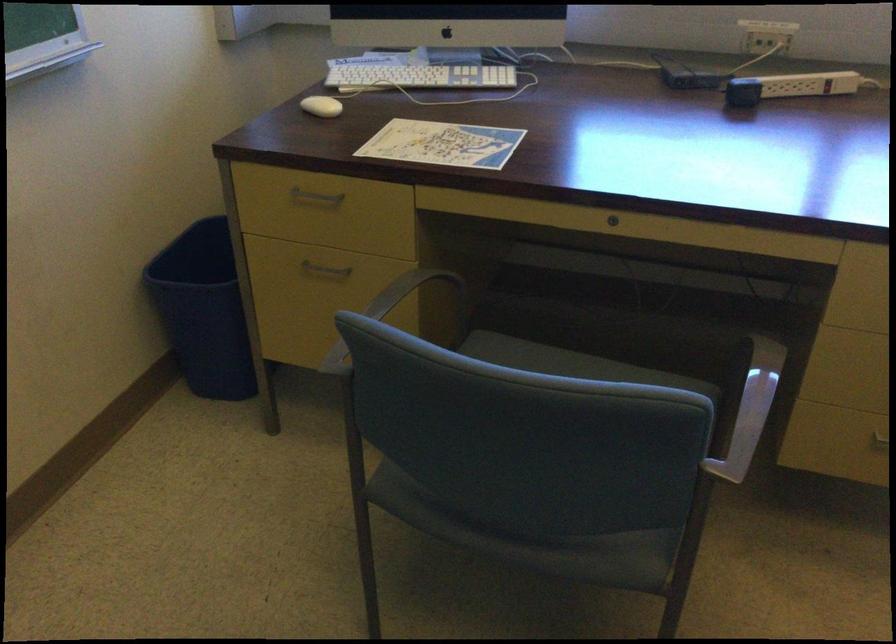
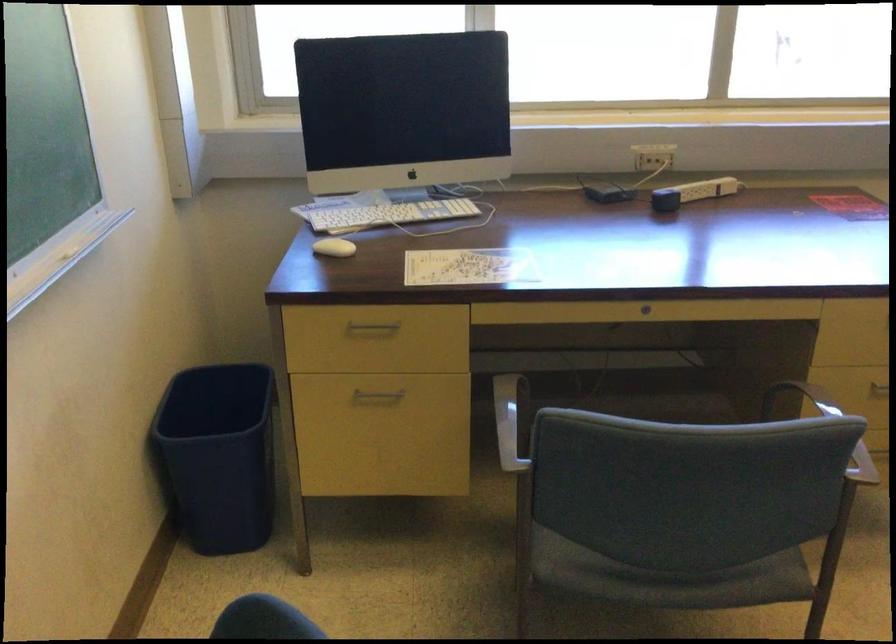
Find the pixel in the second image that matches [375,325] in the first image.

(511, 421)